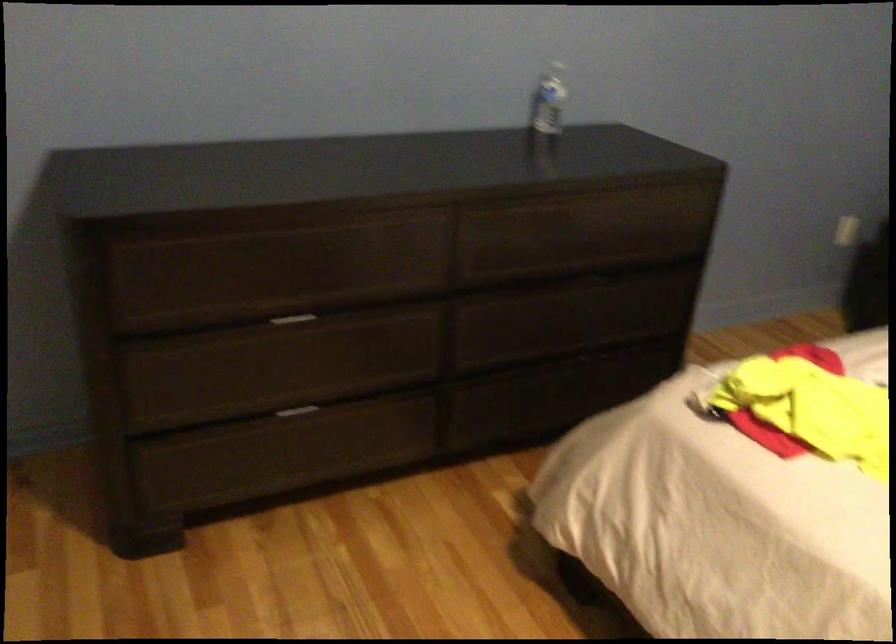
Which object does [548,100] point to?

It corresponds to the plastic water bottle in the image.